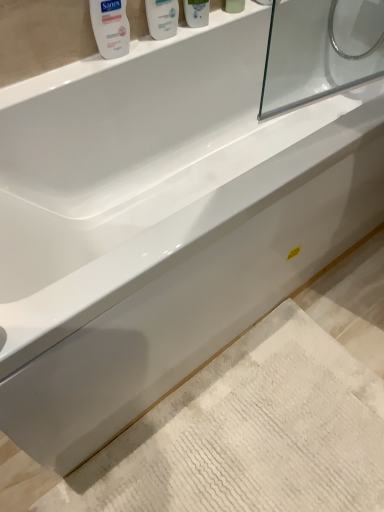
Question: Would you say white textured bath mat at lower center is inside or outside white glossy bottle at upper center, marked as the 2th mouthwash in a right-to-left arrangement?

Choices:
 (A) inside
 (B) outside

Answer: (B)

Question: Considering their positions, is white textured bath mat at lower center located in front of or behind white glossy bottle at upper center, marked as the 2th mouthwash in a right-to-left arrangement?

Choices:
 (A) front
 (B) behind

Answer: (A)

Question: Estimate the real-world distances between objects in this image. Which object is closer to the white glossy bottle at upper center, the 3th mouthwash when ordered from left to right?

Choices:
 (A) green matte mouthwash at upper center, the 4th mouthwash positioned from the left
 (B) white glossy mouthwash at upper left, the fourth mouthwash from the right
 (C) white textured bath mat at lower center
 (D) white glossy mouthwash at upper center, which is the 3th mouthwash in right-to-left order

Answer: (D)

Question: Which is farther from the green matte mouthwash at upper center, which is the first mouthwash in right-to-left order?

Choices:
 (A) white glossy bottle at upper center, marked as the 2th mouthwash in a right-to-left arrangement
 (B) white glossy mouthwash at upper center, which is the 3th mouthwash in right-to-left order
 (C) white glossy mouthwash at upper left, the fourth mouthwash from the right
 (D) white textured bath mat at lower center

Answer: (D)